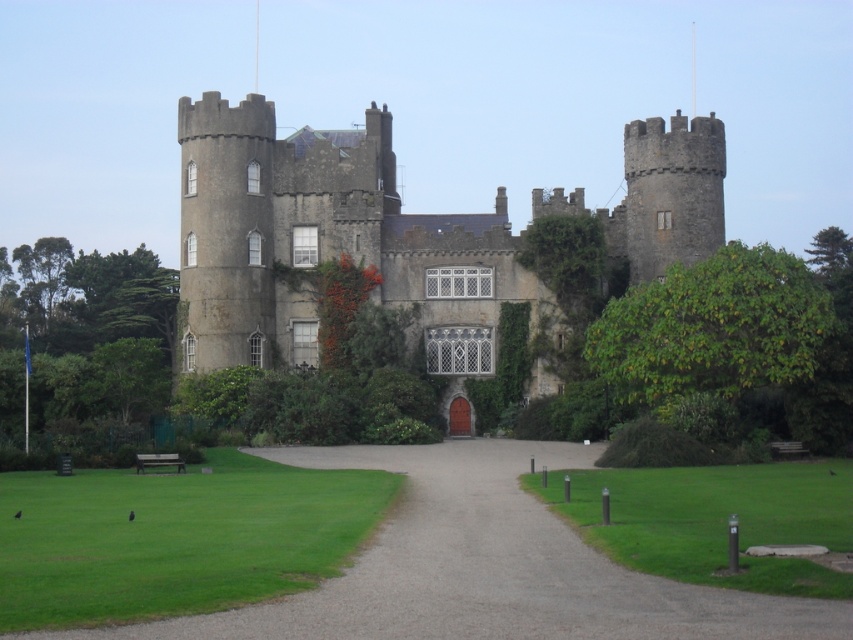
You are standing at point A, which is located at coordinates (323,241). What object is exactly at your current position?

The gray stone castle at center is exactly at point A, which is located at coordinates (323,241).

Consider the image. You are standing at the coordinates point 0.0, 0.0. You want to locate the gray stone castle at center. In which direction should you move relative to your current position?

The gray stone castle at center is located at point (323, 241), so you should move northeast to reach it.

You are a visitor arriving at the gray stone castle at center and need to park your car. The parking area is located on the gray gravel driveway at center. Considering the size of the castle and driveway, will the driveway have enough space to accommodate your car?

The gray stone castle at center is larger in size than the gray gravel driveway at center, so the driveway may not have enough space to accommodate your car.